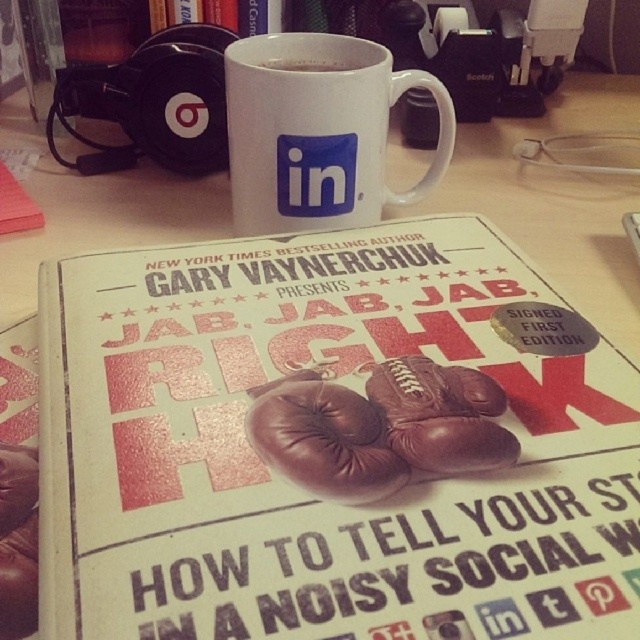
The image size is (640, 640). What do you see at coordinates (332, 444) in the screenshot?
I see `white matte poster at center` at bounding box center [332, 444].

Locate an element on the screen. Image resolution: width=640 pixels, height=640 pixels. white matte poster at center is located at coordinates (332, 444).

Where is `white matte poster at center`? white matte poster at center is located at coordinates (332, 444).

The height and width of the screenshot is (640, 640). I want to click on white matte poster at center, so click(332, 444).

In the scene shown: Between leather boxing glove at center and white matte cup at center, which one appears on the left side from the viewer's perspective?

white matte cup at center

Does leather boxing glove at center come behind white matte cup at center?

No, leather boxing glove at center is closer to the viewer.

Locate an element on the screen. The image size is (640, 640). leather boxing glove at center is located at coordinates (324, 438).

Is point (180, 444) more distant than point (308, 61)?

No, it is in front of (308, 61).

Does white matte poster at center have a greater height compared to white matte cup at center?

Indeed, white matte poster at center has a greater height compared to white matte cup at center.

Identify the location of white matte poster at center. The height and width of the screenshot is (640, 640). (332, 444).